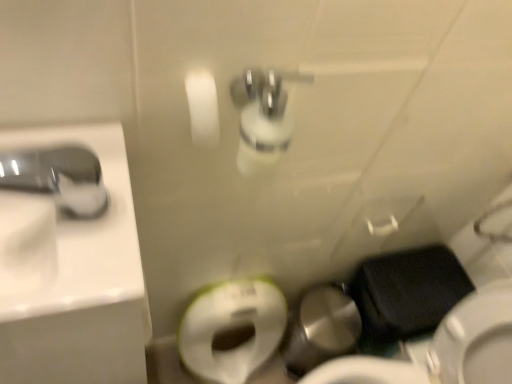
Question: Can you confirm if satin nickel faucet at upper left is smaller than white glossy sink at left?

Choices:
 (A) no
 (B) yes

Answer: (B)

Question: Is satin nickel faucet at upper left with white glossy sink at left?

Choices:
 (A) no
 (B) yes

Answer: (A)

Question: Would you say satin nickel faucet at upper left is a long distance from white glossy sink at left?

Choices:
 (A) yes
 (B) no

Answer: (B)

Question: Is satin nickel faucet at upper left thinner than white glossy sink at left?

Choices:
 (A) yes
 (B) no

Answer: (A)

Question: Would you say white glossy sink at left is part of satin nickel faucet at upper left's contents?

Choices:
 (A) no
 (B) yes

Answer: (A)

Question: From their relative heights in the image, would you say satin nickel faucet at upper left is taller or shorter than black matte wallet at lower right?

Choices:
 (A) short
 (B) tall

Answer: (A)

Question: Considering the positions of point (88, 198) and point (373, 326), is point (88, 198) closer or farther from the camera than point (373, 326)?

Choices:
 (A) farther
 (B) closer

Answer: (B)

Question: Visually, is satin nickel faucet at upper left positioned to the left or to the right of black matte wallet at lower right?

Choices:
 (A) right
 (B) left

Answer: (B)

Question: Looking at the image, does satin nickel faucet at upper left seem bigger or smaller compared to black matte wallet at lower right?

Choices:
 (A) big
 (B) small

Answer: (B)

Question: Visually, is white glossy sink at left positioned to the left or to the right of satin nickel faucet at upper left?

Choices:
 (A) left
 (B) right

Answer: (B)

Question: Considering the positions of white glossy sink at left and satin nickel faucet at upper left in the image, is white glossy sink at left taller or shorter than satin nickel faucet at upper left?

Choices:
 (A) tall
 (B) short

Answer: (A)

Question: Choose the correct answer: Is white glossy sink at left inside satin nickel faucet at upper left or outside it?

Choices:
 (A) inside
 (B) outside

Answer: (B)

Question: From the image's perspective, is white glossy sink at left positioned above or below satin nickel faucet at upper left?

Choices:
 (A) above
 (B) below

Answer: (B)

Question: Choose the correct answer: Is satin nickel faucet at upper left inside white glossy sink at left or outside it?

Choices:
 (A) outside
 (B) inside

Answer: (A)

Question: In the image, is satin nickel faucet at upper left positioned in front of or behind white glossy sink at left?

Choices:
 (A) behind
 (B) front

Answer: (B)